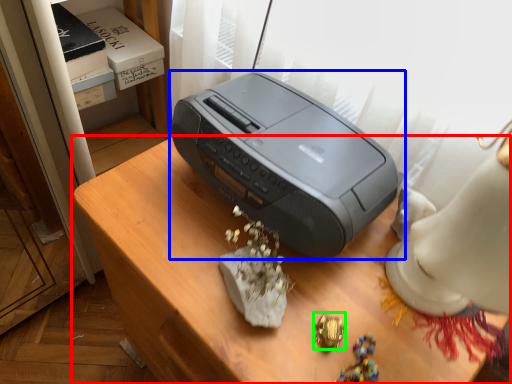
Question: Based on their relative distances, which object is nearer to furniture (highlighted by a red box)? Choose from printer (highlighted by a blue box) and jewellery (highlighted by a green box).

Choices:
 (A) printer
 (B) jewellery

Answer: (A)